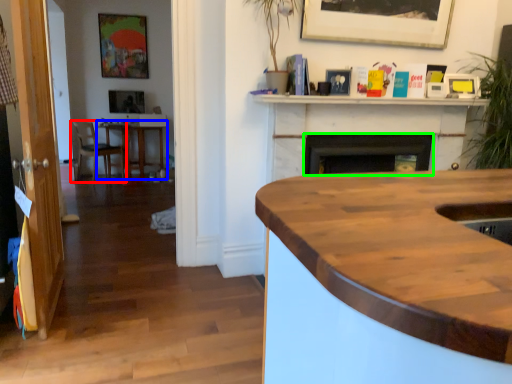
Question: Which object is the closest to the chair (highlighted by a red box)? Choose among these: table (highlighted by a blue box) or fireplace (highlighted by a green box).

Choices:
 (A) table
 (B) fireplace

Answer: (A)